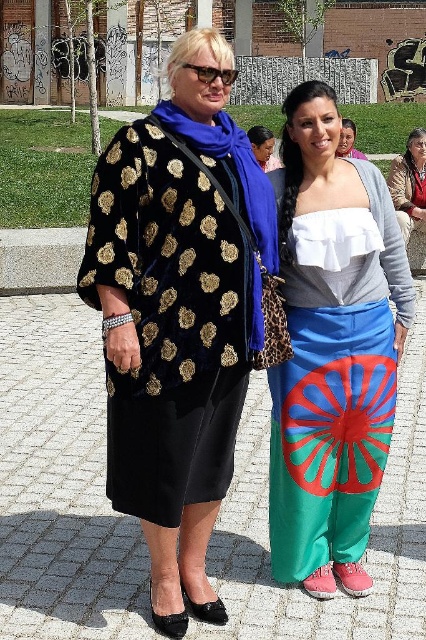
Which of these two, velvet gold shawl at center or matte brown leather jacket at upper right, stands shorter?

velvet gold shawl at center is shorter.

Based on the photo, can you confirm if velvet gold shawl at center is thinner than matte brown leather jacket at upper right?

Incorrect, velvet gold shawl at center's width is not less than matte brown leather jacket at upper right's.

Does point (216, 145) lie in front of point (420, 196)?

That is True.

Identify the location of velvet gold shawl at center. The image size is (426, 640). (236, 170).

Which is more to the right, velvet/black jacket at center or matte brown leather jacket at upper right?

From the viewer's perspective, matte brown leather jacket at upper right appears more on the right side.

From the picture: Between velvet/black jacket at center and matte brown leather jacket at upper right, which one is positioned lower?

velvet/black jacket at center is lower down.

Is point (233, 332) farther from camera compared to point (420, 138)?

No.

I want to click on velvet/black jacket at center, so click(x=178, y=314).

Does velvet/black jacket at center have a smaller size compared to matte blue pants at center?

No.

Which is behind, point (169, 305) or point (374, 323)?

Point (374, 323)

The width and height of the screenshot is (426, 640). In order to click on velvet/black jacket at center in this screenshot , I will do `click(178, 314)`.